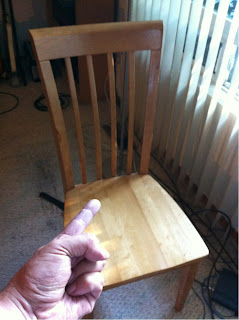
Locate an element on the screen. The image size is (239, 320). back rest is located at coordinates (102, 43).